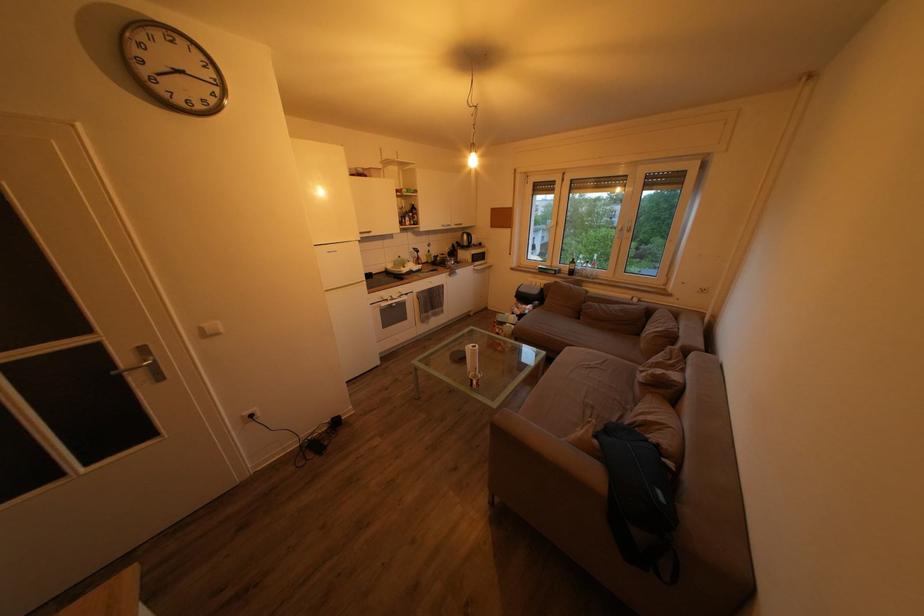
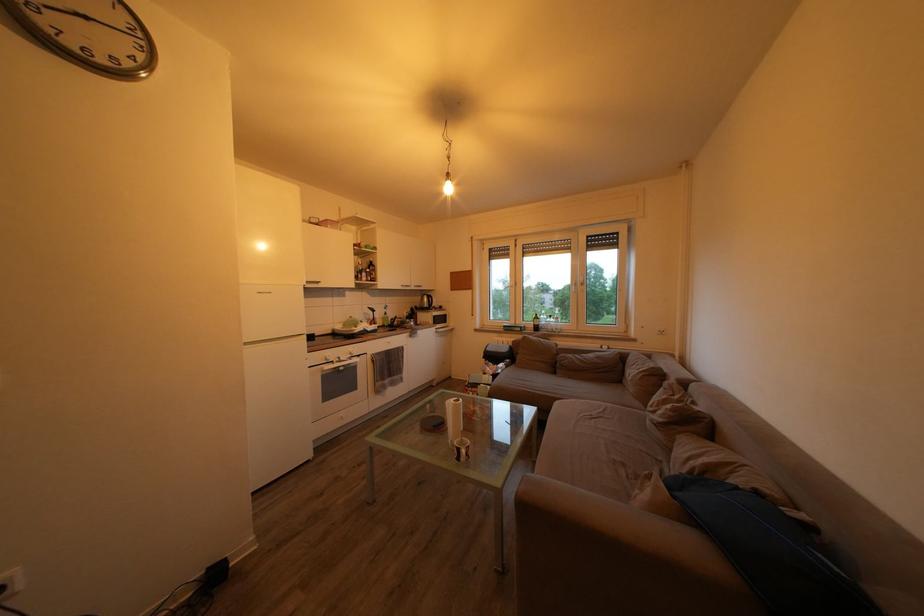
Where in the second image is the point corresponding to (x=455, y=256) from the first image?

(412, 318)